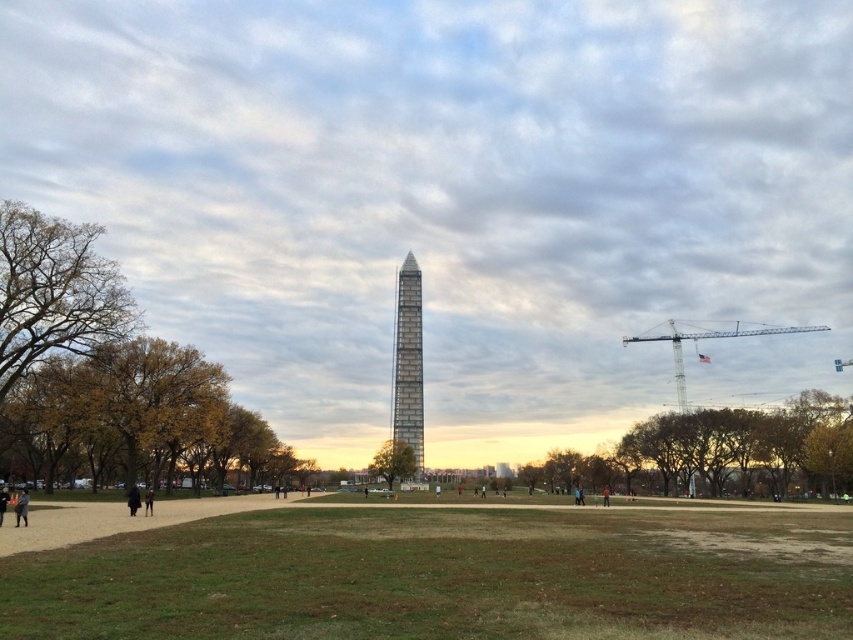
From the picture: You are standing in the park looking at the monument. There are two points marked on the monument. The first point is at coordinates point [25,518] and the second is at point [148,506]. Which point is closer to you?

Point [25,518] is closer to the viewer than point [148,506].